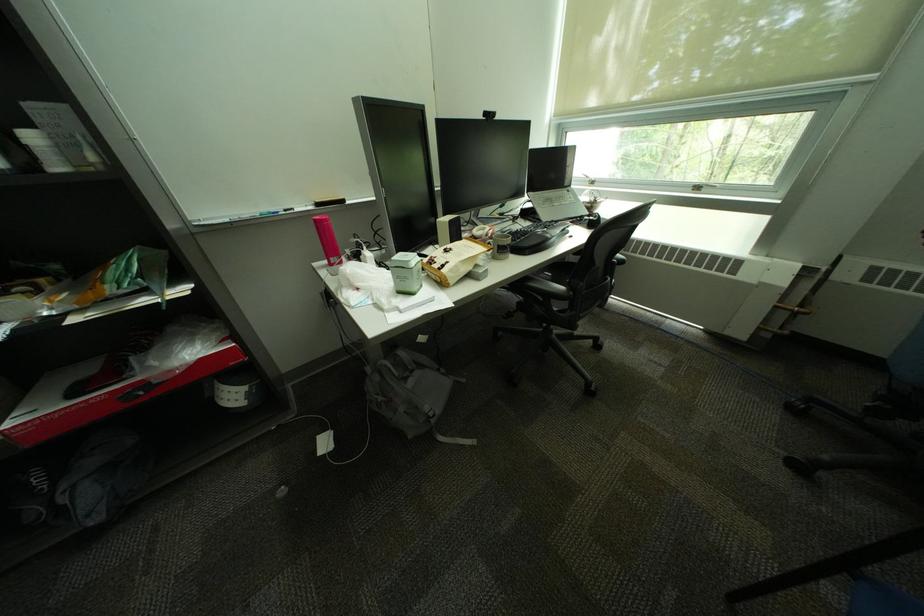
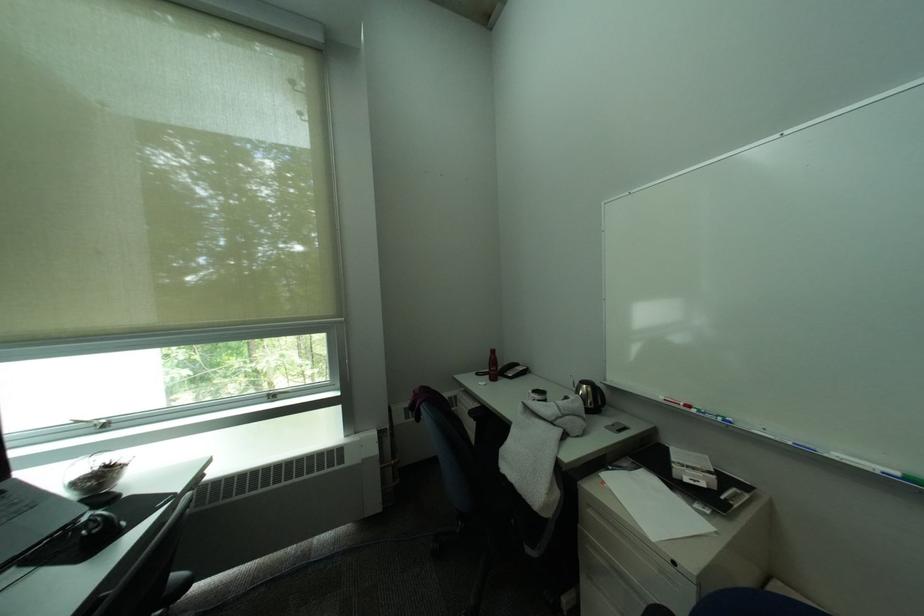
The point at (606,217) is marked in the first image. Where is the corresponding point in the second image?

(106, 528)